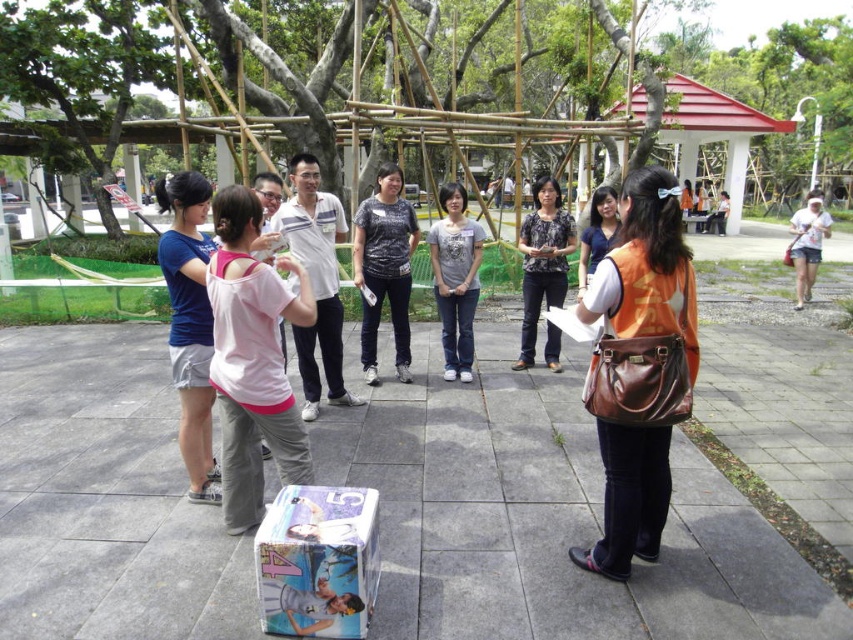
You are a delivery robot with a width of 1.5 meters. You need to move from the blue fabric shorts at left to the white glossy pavement at center. Can you fit through the space between them?

The distance between the blue fabric shorts at left and the white glossy pavement at center is 1.84 meters. Since the robot is 1.5 meters wide, it can fit through the space as the distance is greater than the robot width.

You are a photographer positioned at the edge of the park. You notice the white glossy pavement at center and the camouflage shirt at center. Which object is positioned to the left of the other?

The white glossy pavement at center is to the left of the camouflage shirt at center.

You are organizing a group photo and need to position the camouflage shirt at center and the white cotton shirt at right correctly according to their positions in the park. Which shirt should be placed to the left of the other?

The camouflage shirt at center should be placed to the left of the white cotton shirt at right because the camouflage shirt at center is to the left of white cotton shirt at right.